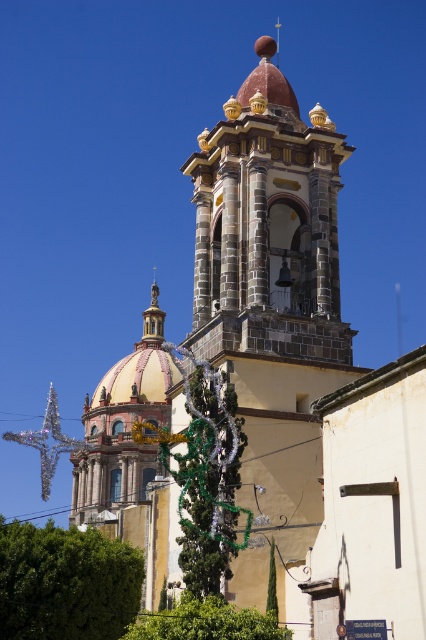
Question: Observing the image, what is the correct spatial positioning of matte stone bell tower at center in reference to green metallic garland at center?

Choices:
 (A) above
 (B) below

Answer: (A)

Question: Which point is closer to the camera taking this photo?

Choices:
 (A) (51, 573)
 (B) (132, 632)
 (C) (275, 604)
 (D) (316, 339)

Answer: (B)

Question: Can you confirm if green leafy tree at lower left is bigger than green metallic garland at center?

Choices:
 (A) yes
 (B) no

Answer: (B)

Question: Is green leafy tree at lower left to the left of green metallic garland at center from the viewer's perspective?

Choices:
 (A) yes
 (B) no

Answer: (A)

Question: Which object is closer to the camera taking this photo?

Choices:
 (A) green leafy tree at lower center
 (B) green leafy tree at lower left
 (C) matte stone bell tower at center
 (D) green metallic garland at center

Answer: (A)

Question: Estimate the real-world distances between objects in this image. Which object is closer to the green leafy tree at center?

Choices:
 (A) matte stone bell tower at center
 (B) green leafy tree at lower left
 (C) green leafy tree at lower center

Answer: (C)